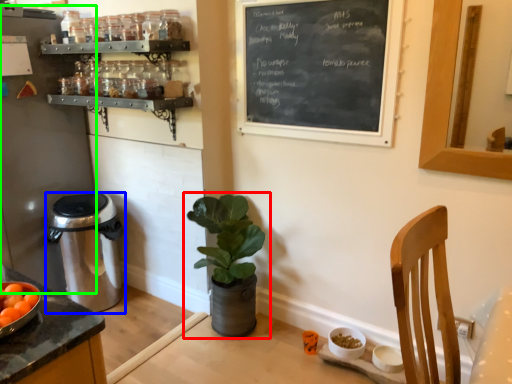
Question: Which object is the farthest from houseplant (highlighted by a red box)? Choose among these: trash bin/can (highlighted by a blue box) or appliance (highlighted by a green box).

Choices:
 (A) trash bin/can
 (B) appliance

Answer: (B)